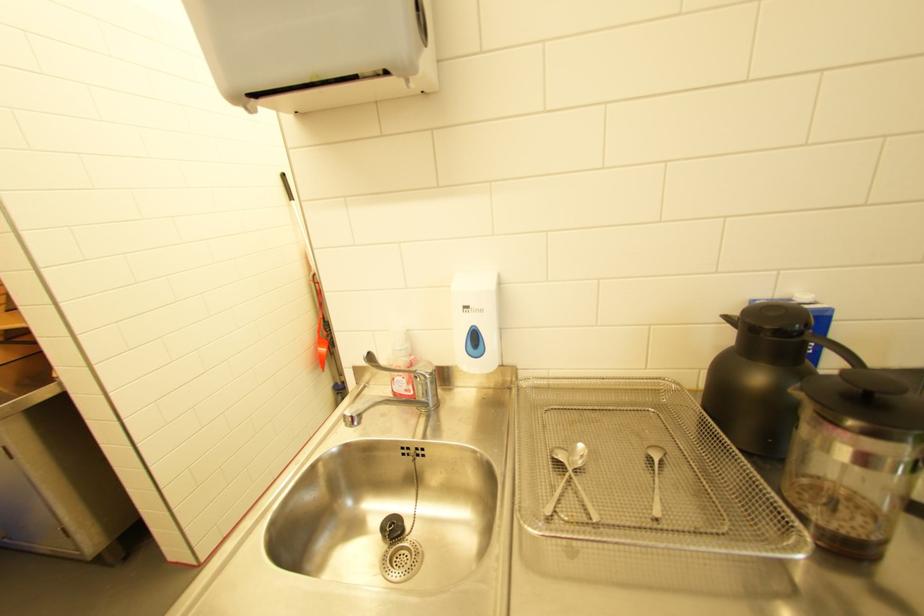
Describe the element at coordinates (774, 318) in the screenshot. I see `the black thermos lid` at that location.